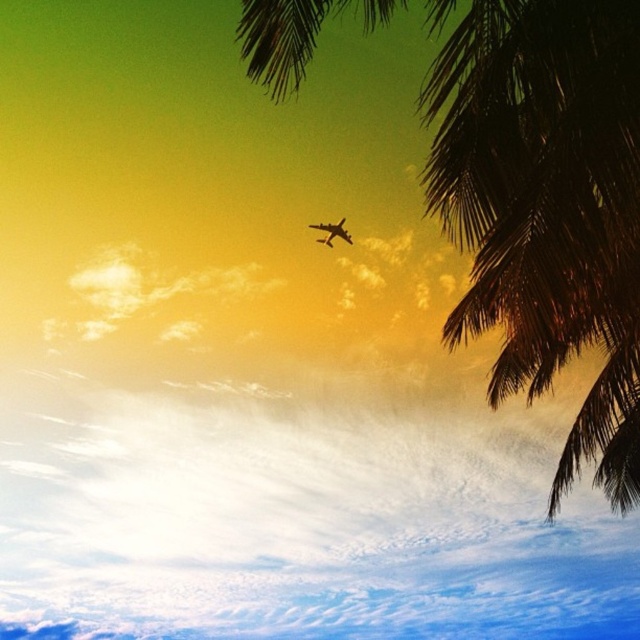
Who is taller, dark green leafy palm tree at upper right or metallic airplane at upper center?

Standing taller between the two is dark green leafy palm tree at upper right.

Who is higher up, dark green leafy palm tree at upper right or metallic airplane at upper center?

metallic airplane at upper center is above.

Find the location of `dark green leafy palm tree at upper right`. dark green leafy palm tree at upper right is located at coordinates click(x=547, y=205).

The width and height of the screenshot is (640, 640). Identify the location of dark green leafy palm tree at upper right. (547, 205).